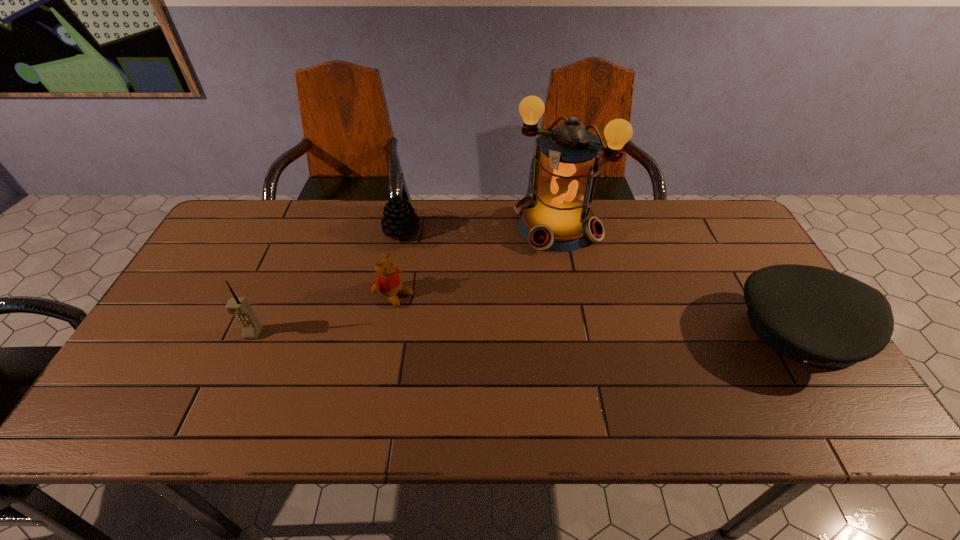
I want to click on the leftmost object, so click(x=239, y=306).

This screenshot has width=960, height=540. Identify the location of the fourth shortest object. (239, 306).

You are a GUI agent. You are given a task and a screenshot of the screen. Output one action in this format:
    pyautogui.click(x=<x>, y=<y>)
    Task: Click on the beret
    This screenshot has width=960, height=540.
    Given the screenshot: What is the action you would take?
    pyautogui.click(x=816, y=316)

Find the location of a particular element. This screenshot has height=540, width=960. teddy bear is located at coordinates (388, 283).

You are a GUI agent. You are given a task and a screenshot of the screen. Output one action in this format:
    pyautogui.click(x=<x>, y=<y>)
    Task: Click on the lantern
    Image resolution: width=960 pixels, height=540 pixels.
    Given the screenshot: What is the action you would take?
    pyautogui.click(x=557, y=217)

The height and width of the screenshot is (540, 960). In order to click on the tallest object in this screenshot , I will do `click(557, 217)`.

This screenshot has width=960, height=540. What are the coordinates of `pinecone` in the screenshot? It's located at pos(399,219).

Identify the location of vacant space located on the front of the cellular telephone, where the keypad is located. This screenshot has width=960, height=540. (237, 371).

This screenshot has height=540, width=960. I want to click on vacant region located on the front-facing side of the teddy bear, so [530, 381].

The width and height of the screenshot is (960, 540). In order to click on vacant space situated on the front-facing side of the teddy bear in this screenshot , I will do `click(448, 328)`.